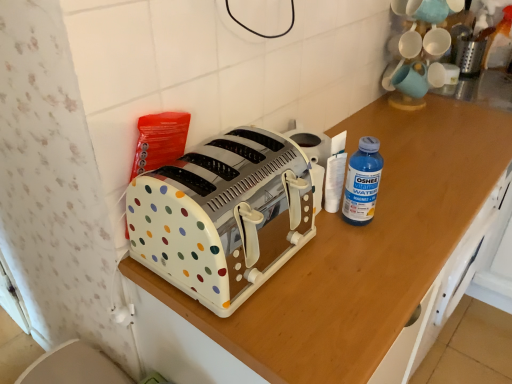
Locate an element on the screen. free location to the left of blue plastic bottle at right is located at coordinates 308,241.